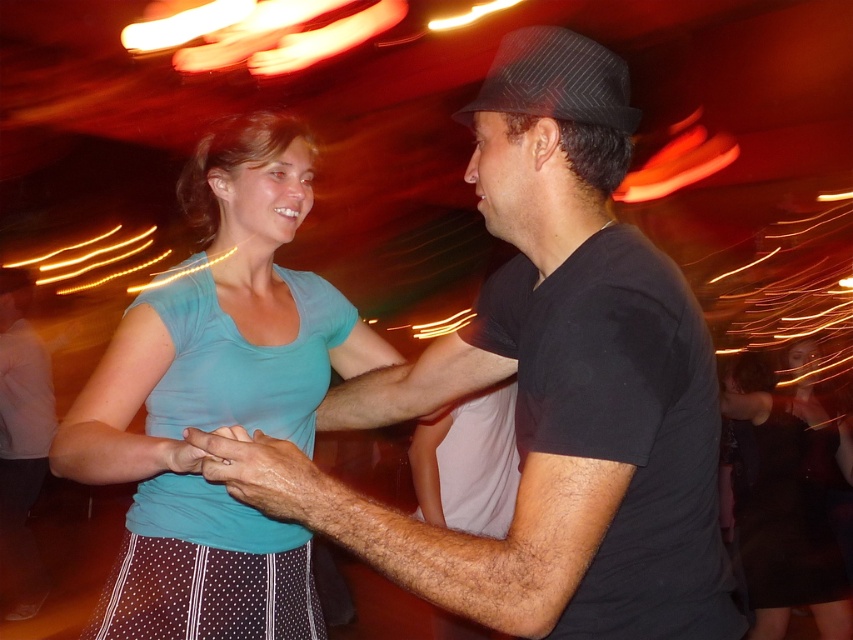
You are a photographer at a dance event. You need to capture a photo where the black matte shirt at center and the teal matte shirt at center are clearly visible. Based on their heights, which shirt should you focus on to ensure it doesn t get cut off at the bottom of the frame?

The black matte shirt at center is shorter than the teal matte shirt at center. To avoid cutting off the bottom of the frame, focus on the teal matte shirt at center since it is taller and more likely to be fully visible.

You are a photographer standing at the camera position. You want to take a photo of the scene. There is a point at coordinates point (x=488, y=80) in the image. Can you reach that point with your hand to adjust something if you can extend your arm 1 meter?

The point at coordinates point (x=488, y=80) is 1.05 meters away from the camera. Since your arm can only extend 1 meter, you cannot reach that point.

You are a photographer at the dance event. You want to capture a photo where both the woman and the man are clearly visible. The woman is at point (222,321) and the man is at point (746,416). Based on their positions, which person is closer to the camera and should be in focus to ensure their face is sharp?

Point (222,321) is in front of point (746,416), so the woman at point (222,321) should be in focus to ensure her face is sharp.